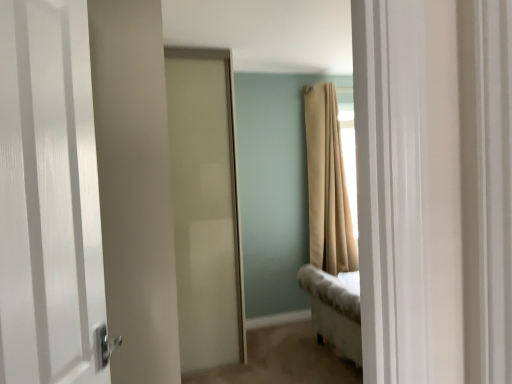
Question: Is white glossy door at left, which is counted as the 2th door, starting from the back, oriented away from beige fabric curtain at upper right?

Choices:
 (A) yes
 (B) no

Answer: (B)

Question: Is beige fabric curtain at upper right located within white glossy door at left, which is counted as the 2th door, starting from the back?

Choices:
 (A) yes
 (B) no

Answer: (B)

Question: Does white glossy door at left, positioned as the first door in front-to-back order, come in front of beige fabric curtain at upper right?

Choices:
 (A) yes
 (B) no

Answer: (A)

Question: Does white glossy door at left, positioned as the first door in front-to-back order, appear on the right side of beige fabric curtain at upper right?

Choices:
 (A) no
 (B) yes

Answer: (A)

Question: Considering the relative sizes of white glossy door at left, positioned as the first door in front-to-back order, and beige fabric curtain at upper right in the image provided, is white glossy door at left, positioned as the first door in front-to-back order, bigger than beige fabric curtain at upper right?

Choices:
 (A) yes
 (B) no

Answer: (B)

Question: Relative to white glossy door at left, which is counted as the 2th door, starting from the back, is satin white door at center, the 1th door from the back, in front or behind?

Choices:
 (A) front
 (B) behind

Answer: (B)

Question: In the image, is satin white door at center, the 1th door from the back, on the left side or the right side of white glossy door at left, positioned as the first door in front-to-back order?

Choices:
 (A) right
 (B) left

Answer: (A)

Question: Considering the positions of satin white door at center, placed as the 2th door when sorted from front to back, and white glossy door at left, positioned as the first door in front-to-back order, in the image, is satin white door at center, placed as the 2th door when sorted from front to back, wider or thinner than white glossy door at left, positioned as the first door in front-to-back order,?

Choices:
 (A) wide
 (B) thin

Answer: (A)

Question: From the image's perspective, is satin white door at center, placed as the 2th door when sorted from front to back, located above or below white glossy door at left, positioned as the first door in front-to-back order?

Choices:
 (A) above
 (B) below

Answer: (B)

Question: Is white glossy door at left, positioned as the first door in front-to-back order, inside or outside of satin white door at center, the 1th door from the back?

Choices:
 (A) outside
 (B) inside

Answer: (A)

Question: Is white glossy door at left, which is counted as the 2th door, starting from the back, in front of or behind satin white door at center, the 1th door from the back, in the image?

Choices:
 (A) behind
 (B) front

Answer: (B)

Question: Is white glossy door at left, which is counted as the 2th door, starting from the back, wider or thinner than satin white door at center, placed as the 2th door when sorted from front to back?

Choices:
 (A) thin
 (B) wide

Answer: (A)

Question: Is white glossy door at left, which is counted as the 2th door, starting from the back, taller or shorter than satin white door at center, placed as the 2th door when sorted from front to back?

Choices:
 (A) short
 (B) tall

Answer: (A)

Question: Is white glossy door at left, positioned as the first door in front-to-back order, wider or thinner than beige fabric curtain at upper right?

Choices:
 (A) thin
 (B) wide

Answer: (A)

Question: Is white glossy door at left, positioned as the first door in front-to-back order, inside or outside of beige fabric curtain at upper right?

Choices:
 (A) inside
 (B) outside

Answer: (B)